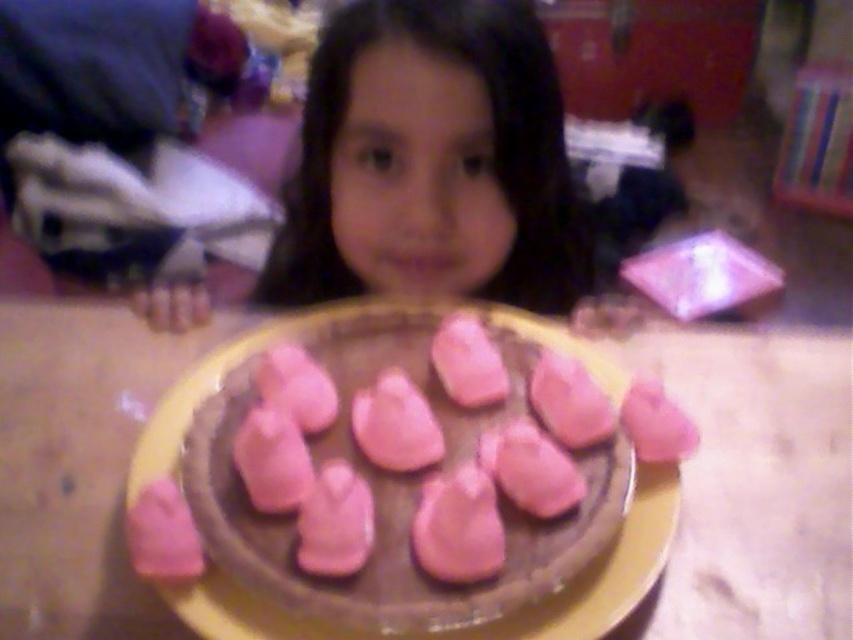
You are a guest at a birthday party and see two desserts on the table. The pink matte chocolate cake at center and the pink matte meringue at center. Which dessert is positioned to the right?

The pink matte meringue at center is positioned to the right of the pink matte chocolate cake at center.

You are a guest at a birthday party and see both the pink matte chocolate cake at center and the pink matte meringue at center. Which dessert would you choose if you prefer something smaller in size?

The pink matte meringue at center is smaller than the pink matte chocolate cake at center, so you should choose the pink matte meringue at center if you prefer something smaller in size.

Looking at the image, where is the smooth skin face at center in relation to the pink matte meringue at center?

The smooth skin face at center is to the left of the pink matte meringue at center.